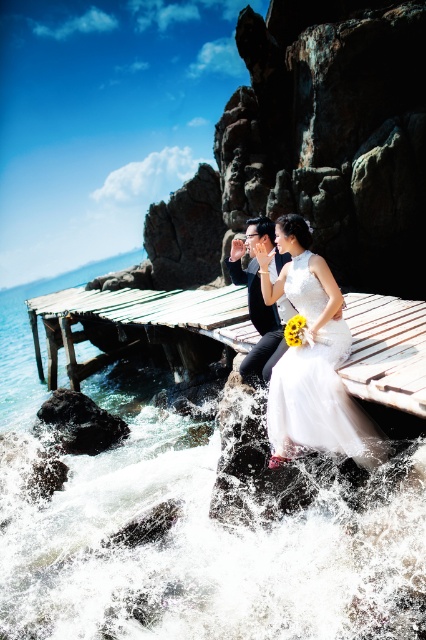
Does white satin dress at center lie behind matte black suit at center?

No.

Between white satin dress at center and matte black suit at center, which one has less height?

matte black suit at center

Which is in front, point (307, 337) or point (287, 310)?

Point (307, 337) is in front.

Image resolution: width=426 pixels, height=640 pixels. Find the location of `white satin dress at center`. white satin dress at center is located at coordinates (313, 358).

Between point (328, 618) and point (259, 378), which one is positioned behind?

The point (259, 378) is behind.

At what (x,y) coordinates should I click in order to perform the action: click on white frothy water at lower center. Please return your answer as a coordinate pair (x, y). The image size is (426, 640). Looking at the image, I should click on (186, 531).

Which of these two, white frothy water at lower center or weathered wood dock at center, stands taller?

weathered wood dock at center

Between white frothy water at lower center and weathered wood dock at center, which one appears on the left side from the viewer's perspective?

white frothy water at lower center

Between point (238, 570) and point (97, 291), which one is positioned in front?

Point (238, 570)

The image size is (426, 640). I want to click on white frothy water at lower center, so point(186,531).